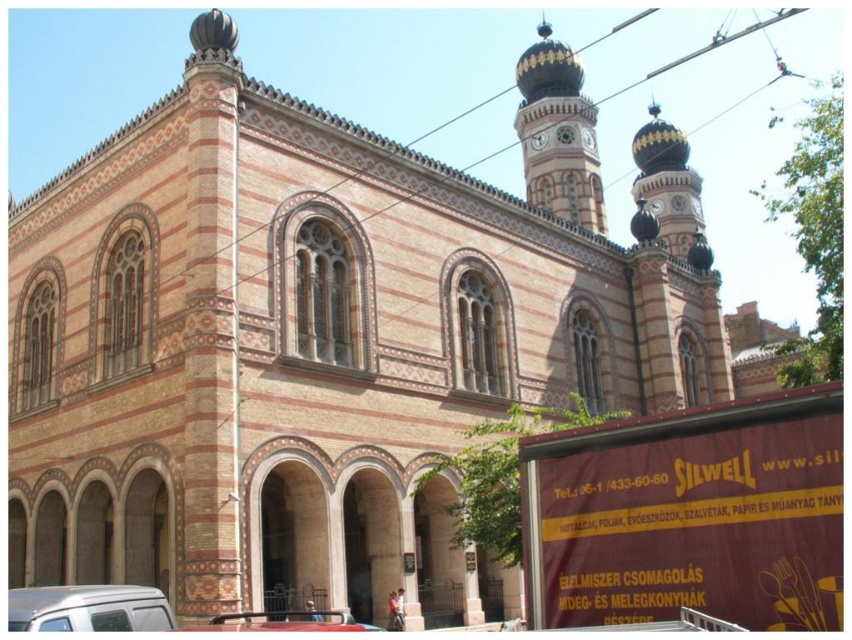
Who is taller, white matte van at lower left or metallic silver car at lower center?

With more height is metallic silver car at lower center.

Measure the distance between white matte van at lower left and metallic silver car at lower center.

The distance of white matte van at lower left from metallic silver car at lower center is 20.33 feet.

Is point (154, 624) more distant than point (318, 620)?

That is False.

The height and width of the screenshot is (640, 852). In order to click on white matte van at lower left in this screenshot , I will do `click(88, 609)`.